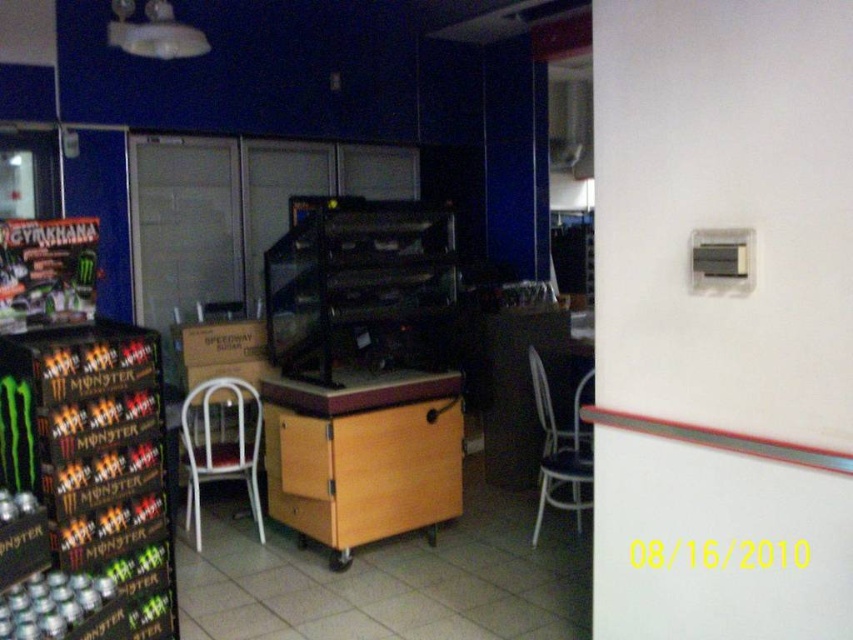
You are a customer standing at the entrance of the food service area and want to sit down. There is a wooden table at center and a white metal chair at center. Which object should you approach first to reach the chair?

You should approach the wooden table at center first because it is closer to you than the white metal chair at center, so you need to go around or past the table to reach the chair.

You are standing at the entrance of the food service area and need to place an order. Where is the wooden table at center in relation to the Monster Energy drink cases on the left?

The wooden table at center is located at point (x=363, y=456), which is to the right of the Monster Energy drink cases on the left.